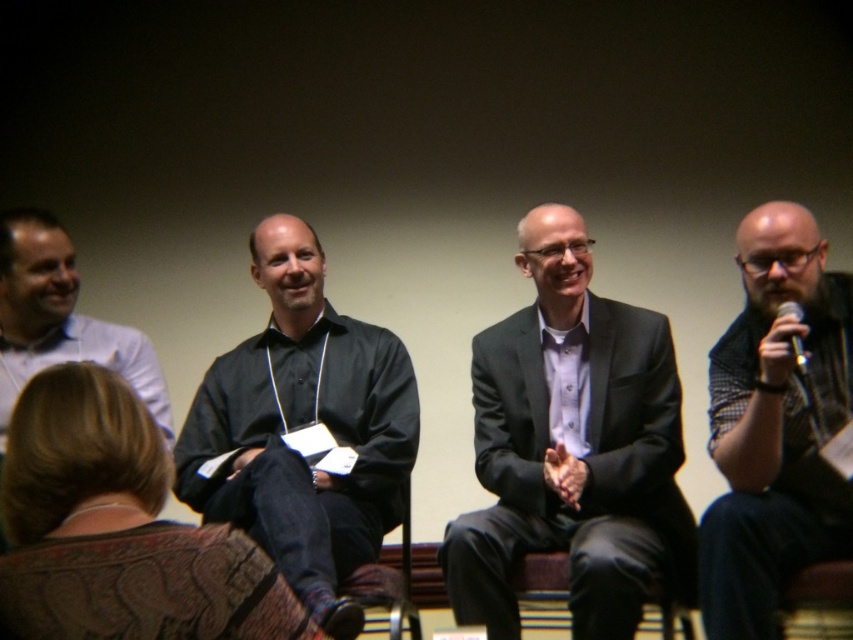
You are sitting in the audience and looking at the panelists. Which of the two points, point (x=125, y=349) or point (x=796, y=369), is closer to you?

Point (x=125, y=349) is closer to you because it is further to the viewer than point (x=796, y=369).